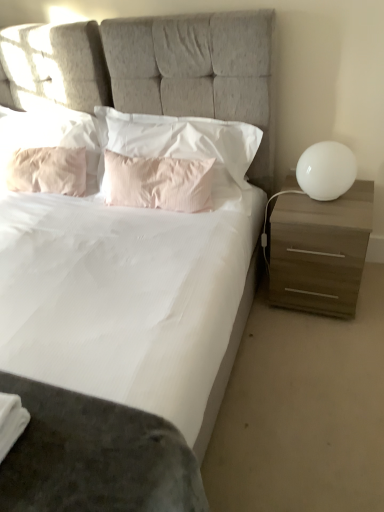
Where is `free spot in front of white glossy sphere at right`? This screenshot has height=512, width=384. free spot in front of white glossy sphere at right is located at coordinates (336, 215).